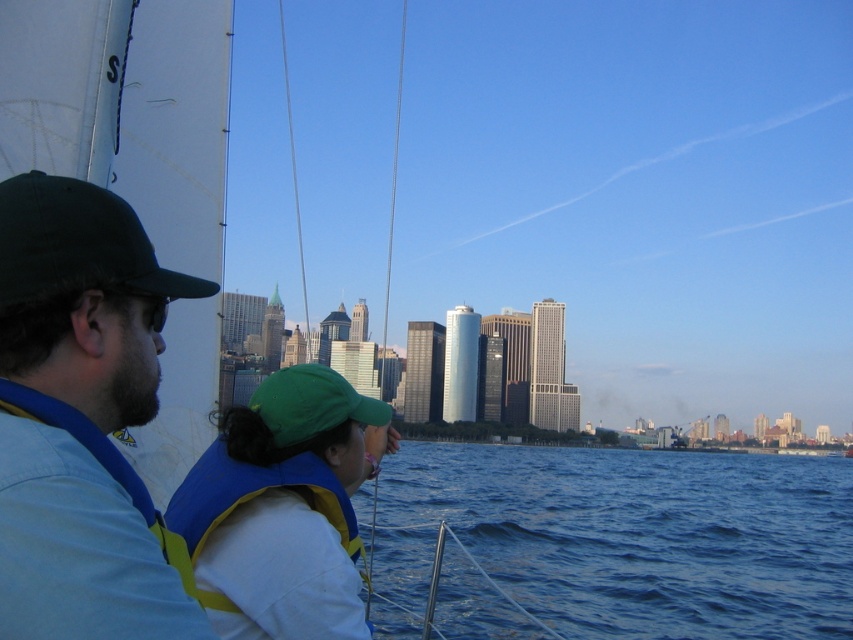
You are standing on the sailboat and see the point at coordinates (625, 538). What is the location of this point relative to the blue water at lower center?

The point at coordinates (625, 538) is located on the blue water at lower center.

Consider the image. You are standing on the deck of the sailboat and see two points marked on the water surface. The first point is at coordinates point (68, 392) and the second is at point (260, 394). Which point is closer to you?

Point (68, 392) is closer to the viewer than point (260, 394).

You are a photographer on the sailboat and want to capture both the dark green fabric cap at left and the green fabric baseball cap at center in a single frame. Which cap appears taller in the photo?

The dark green fabric cap at left appears taller in the photo because it has a greater height compared to the green fabric baseball cap at center.